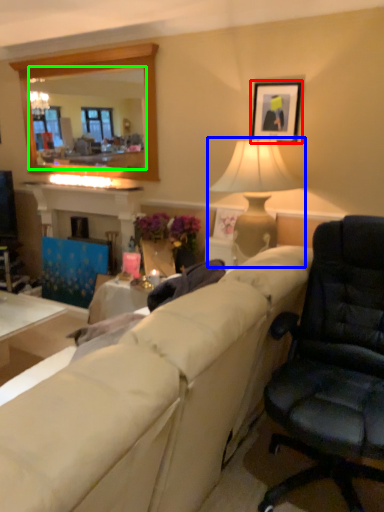
Question: Based on their relative distances, which object is farther from picture frame (highlighted by a red box)? Choose from lamp (highlighted by a blue box) and mirror (highlighted by a green box).

Choices:
 (A) lamp
 (B) mirror

Answer: (B)